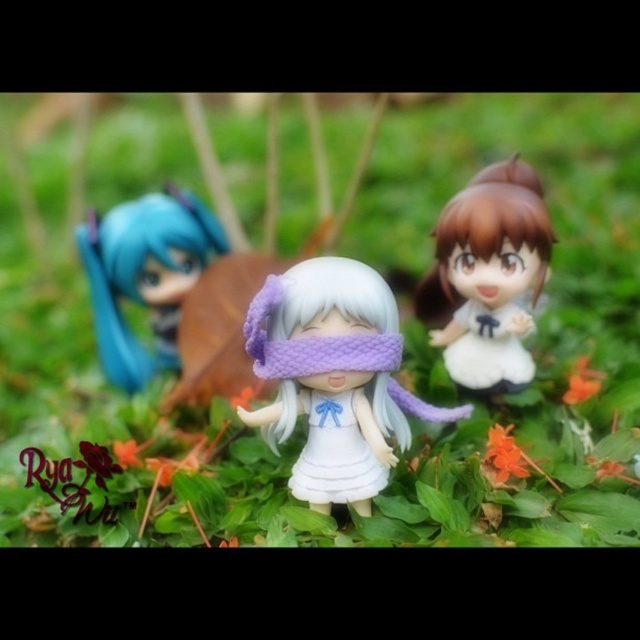
You are an artist examining the figurines in the scene. You notice the white fabric doll at center and the white matte dress at center. Which object is positioned closer to you?

The white fabric doll at center is closer to the viewer than the white matte dress at center.

You are a collector who wants to place a new figurine between the white fabric doll at center and the white matte dress at center. The new figurine is 4 centimeters wide. Can it fit in the space between them?

The space between the white fabric doll at center and the white matte dress at center is 5.06 centimeters. Since the new figurine is 4 centimeters wide, it can fit in the available space as 4 cm is less than 5.06 cm.